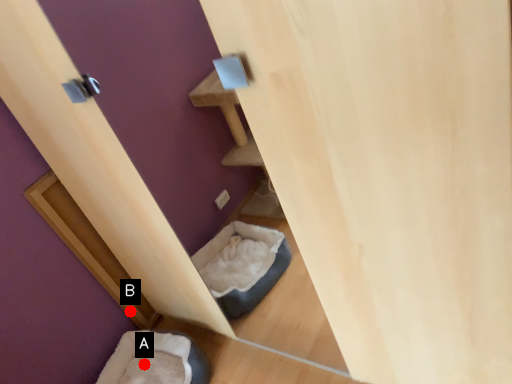
Question: Two points are circled on the image, labeled by A and B beside each circle. Which of the following is the closest to the observer?

Choices:
 (A) A is closer
 (B) B is closer

Answer: (A)